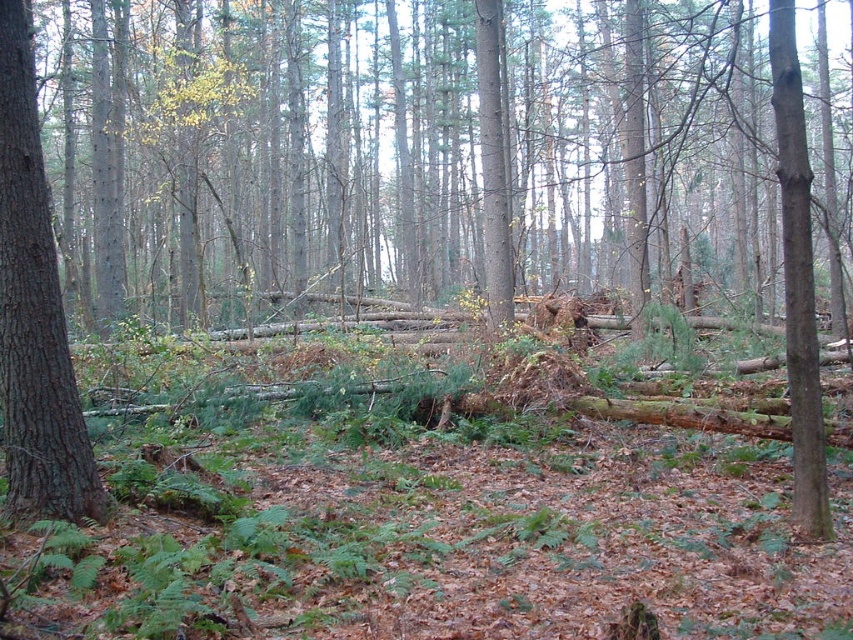
You are a hiker navigating through the dense forest. You see the smooth brown tree trunk at left and the brown rough tree trunk at right. Which tree trunk is closer to you?

The smooth brown tree trunk at left is closer to you because it is positioned in front of the brown rough tree trunk at right.